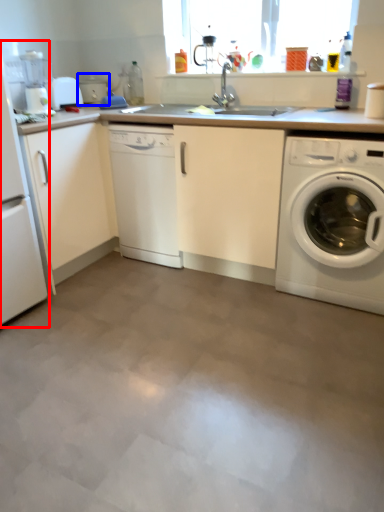
Question: Which point is further to the camera, home appliance (highlighted by a red box) or appliance (highlighted by a blue box)?

Choices:
 (A) home appliance
 (B) appliance

Answer: (B)